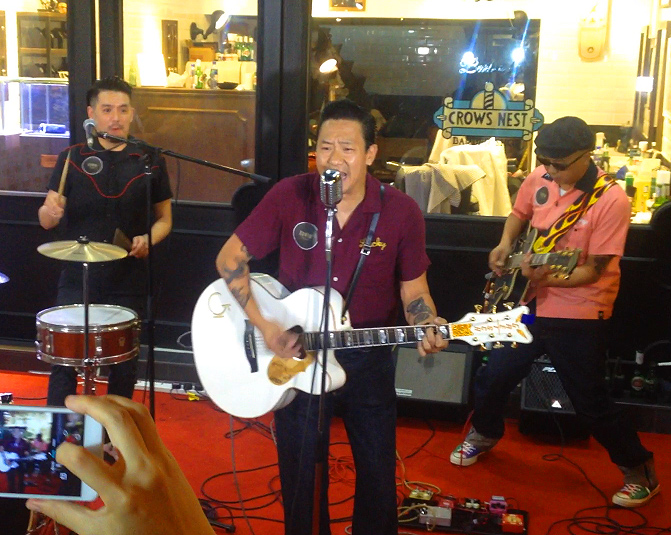
Identify the location of window. This screenshot has height=535, width=671. tap(402, 72).